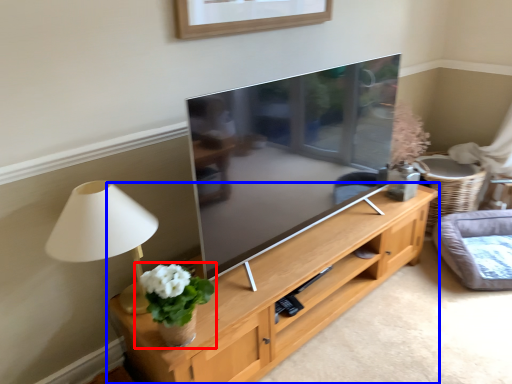
Question: Which object appears closest to the camera in this image, houseplant (highlighted by a red box) or shelf (highlighted by a blue box)?

Choices:
 (A) houseplant
 (B) shelf

Answer: (B)